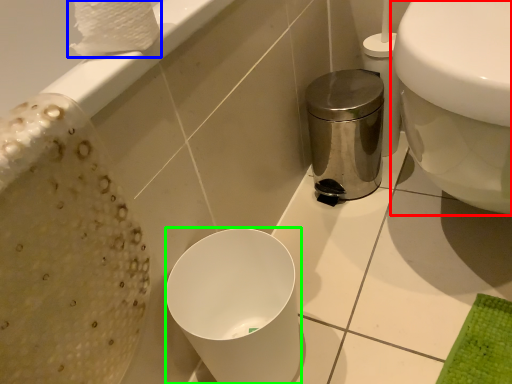
Question: Which object is positioned closest to toilet (highlighted by a red box)? Select from toilet paper (highlighted by a blue box) and bidet (highlighted by a green box).

Choices:
 (A) toilet paper
 (B) bidet

Answer: (B)